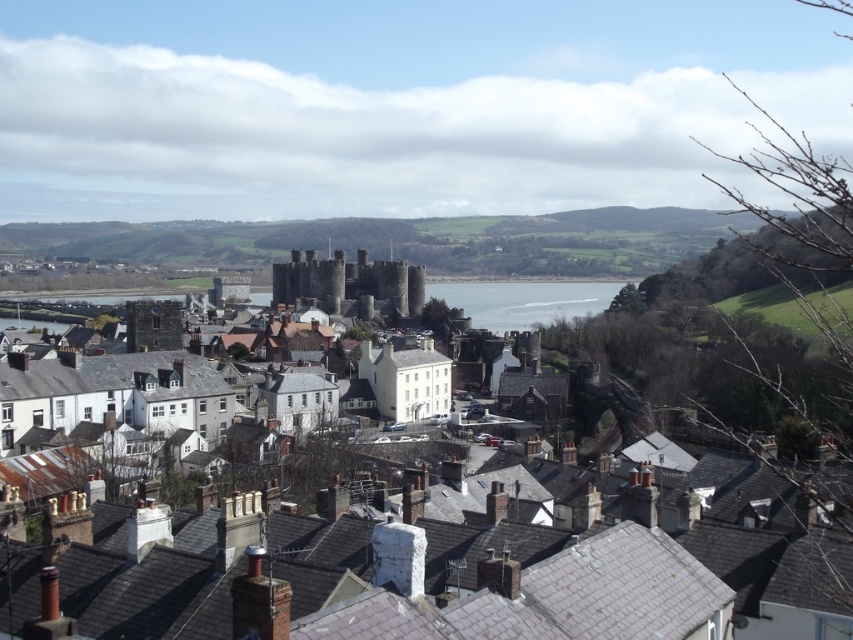
You are standing at the camera position and want to reach the point marked at coordinates (332,269). The path ahead is a straight walkway that is 1000 feet long. Will you reach the point before the walkway ends?

The point marked at coordinates (332,269) is 1113.42 feet away from the camera. Since the walkway is only 1000 feet long, you will not reach the point before the walkway ends because the distance to the point exceeds the walkway length.

You are standing at the point marked as point (469, 582) in the image. Based on the scene description, what structure are you currently on?

The point (469, 582) is on the stone castle at center, so you are currently on the Conwy Castle.